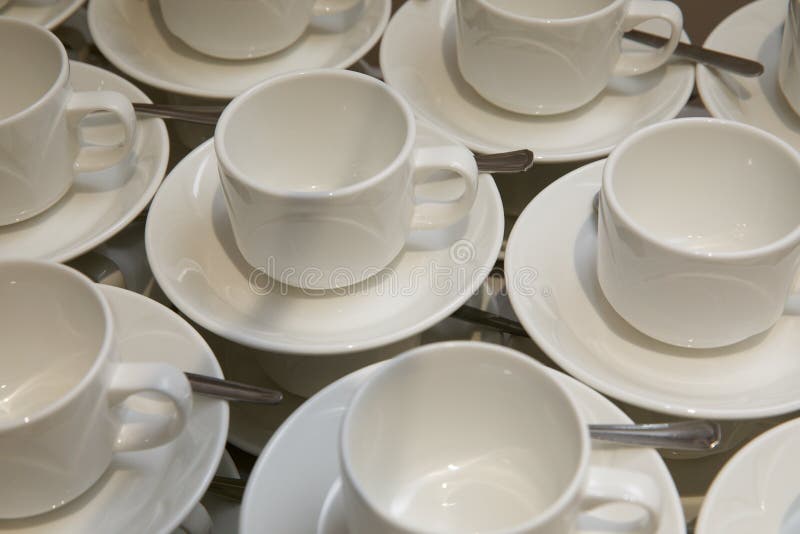
The image size is (800, 534). Find the location of `silverware`. silverware is located at coordinates (218, 387), (678, 437), (232, 489), (478, 318), (186, 113), (508, 160), (726, 60).